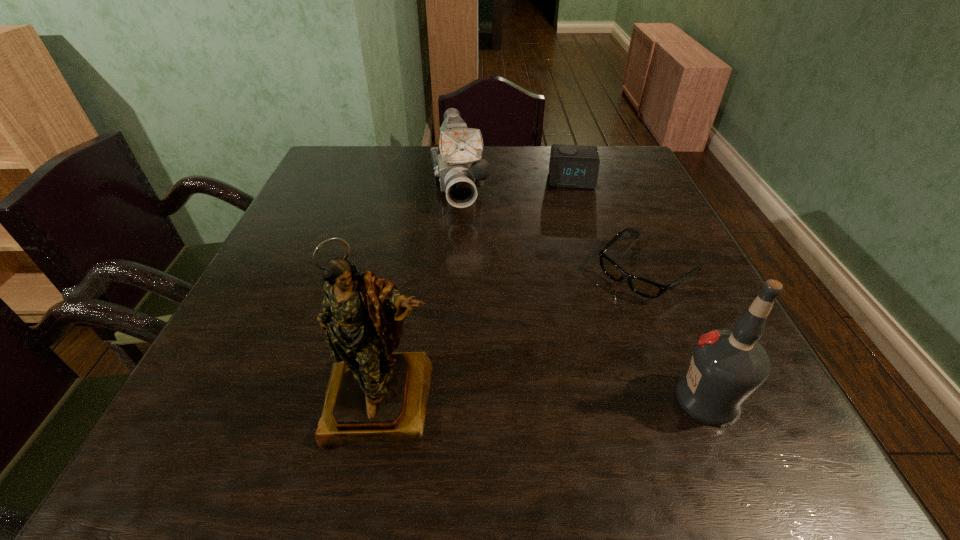
Identify the location of figurine at the near edge. (373, 394).

What are the coordinates of `vodka that is at the near edge` in the screenshot? It's located at (728, 365).

This screenshot has width=960, height=540. What are the coordinates of `vodka at the right edge` in the screenshot? It's located at (728, 365).

What are the coordinates of `alarm clock present at the right edge` in the screenshot? It's located at (571, 166).

I want to click on spectacles present at the right edge, so click(x=643, y=287).

Where is `object located in the far right corner section of the desktop`? The width and height of the screenshot is (960, 540). object located in the far right corner section of the desktop is located at coordinates 571,166.

This screenshot has width=960, height=540. I want to click on object positioned at the near right corner, so click(x=728, y=365).

You are a GUI agent. You are given a task and a screenshot of the screen. Output one action in this format:
    pyautogui.click(x=<x>, y=<y>)
    Task: Click on the vacant space at the far edge
    
    Given the screenshot: What is the action you would take?
    pyautogui.click(x=420, y=159)

Where is `free space at the near edge of the desktop`? The width and height of the screenshot is (960, 540). free space at the near edge of the desktop is located at coordinates (301, 383).

What are the coordinates of `vacant region at the left edge` in the screenshot? It's located at (284, 359).